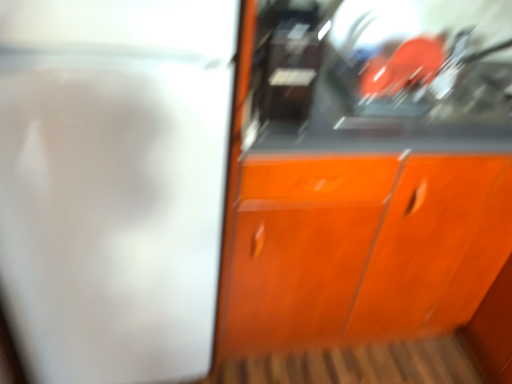
Question: Is orange wood cabinet at center positioned far away from white glossy screen door at left?

Choices:
 (A) no
 (B) yes

Answer: (A)

Question: Is orange wood cabinet at center outside of white glossy screen door at left?

Choices:
 (A) yes
 (B) no

Answer: (A)

Question: Are orange wood cabinet at center and white glossy screen door at left beside each other?

Choices:
 (A) yes
 (B) no

Answer: (B)

Question: Can you confirm if orange wood cabinet at center is smaller than white glossy screen door at left?

Choices:
 (A) yes
 (B) no

Answer: (B)

Question: Is orange wood cabinet at center facing away from white glossy screen door at left?

Choices:
 (A) no
 (B) yes

Answer: (A)

Question: From a real-world perspective, does orange wood cabinet at center sit lower than white glossy screen door at left?

Choices:
 (A) no
 (B) yes

Answer: (B)

Question: From a real-world perspective, does white glossy screen door at left sit lower than orange wood cabinet at center?

Choices:
 (A) no
 (B) yes

Answer: (A)

Question: Is white glossy screen door at left wider than orange wood cabinet at center?

Choices:
 (A) no
 (B) yes

Answer: (B)

Question: Considering the relative positions of white glossy screen door at left and orange wood cabinet at center in the image provided, is white glossy screen door at left to the left of orange wood cabinet at center from the viewer's perspective?

Choices:
 (A) yes
 (B) no

Answer: (A)

Question: Is the depth of white glossy screen door at left greater than that of orange wood cabinet at center?

Choices:
 (A) no
 (B) yes

Answer: (A)

Question: From a real-world perspective, is white glossy screen door at left physically above orange wood cabinet at center?

Choices:
 (A) no
 (B) yes

Answer: (B)

Question: From the image's perspective, is white glossy screen door at left below orange wood cabinet at center?

Choices:
 (A) no
 (B) yes

Answer: (A)

Question: Which is correct: white glossy screen door at left is inside orange wood cabinet at center, or outside of it?

Choices:
 (A) inside
 (B) outside

Answer: (B)